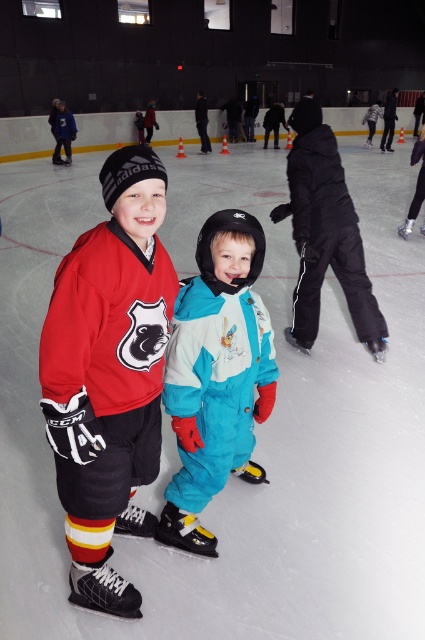
You are standing at the camera position and want to reach the point at coordinates point (127, 310). If your maximum reach is 1.5 meters, can you reach it without moving?

The distance of point (127, 310) from camera is 1.60 meters, so you cannot reach it without moving since it is further than your maximum reach of 1.5 meters.

You are a photographer standing at the edge of the ice rink. You want to take a photo of both the matte red hockey jersey at center and the black matte snowsuit at center. Since you have a camera with a fixed focal length, you need to know which of the two is narrower to ensure both fit in the frame. Which one is narrower?

The matte red hockey jersey at center is narrower than the black matte snowsuit at center, so it will fit better in the frame.

You are a photographer at the ice rink and want to ensure both the matte red hockey jersey at center and the teal snowsuit at center are clearly visible in your photo. Given their sizes, which one might require more careful framing to avoid being too small in the shot?

The teal snowsuit at center is smaller in size compared to the matte red hockey jersey at center, so it might require more careful framing to avoid being too small in the shot.